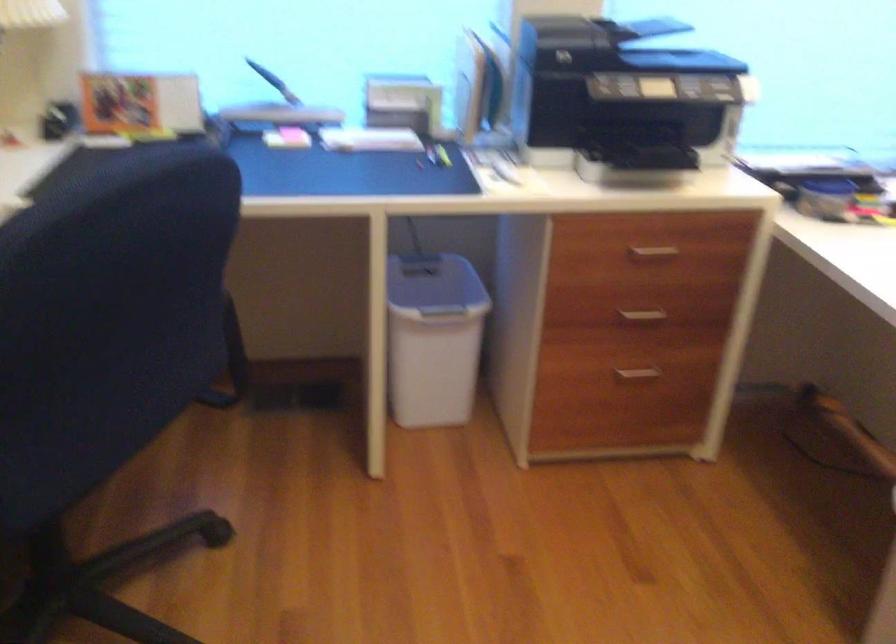
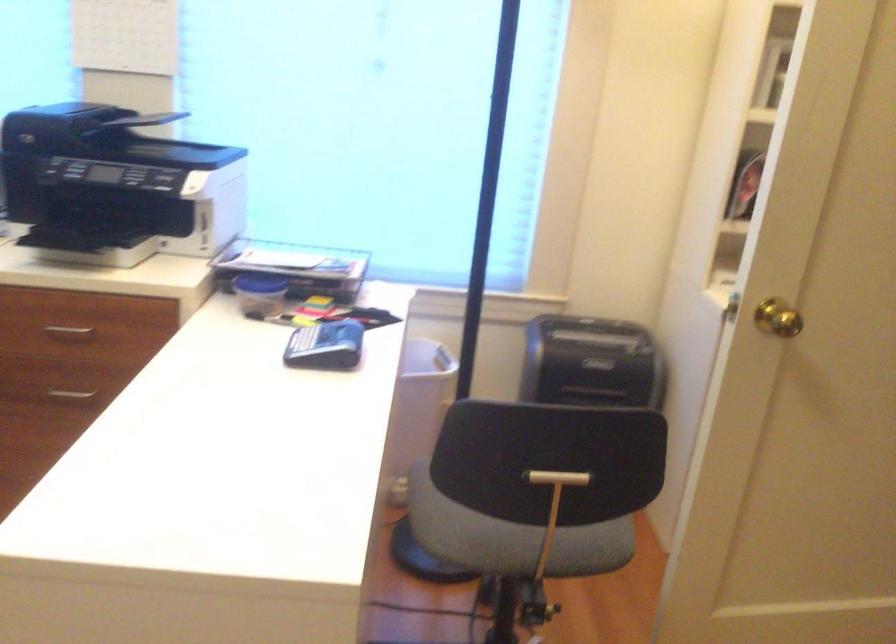
Question: In a continuous first-person perspective shot, in which direction is the camera moving?

Choices:
 (A) Left
 (B) Right
 (C) Forward
 (D) Backward

Answer: (B)